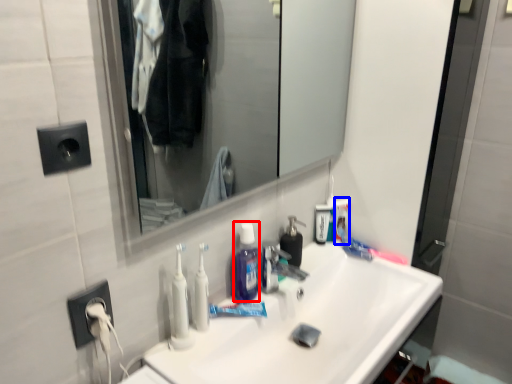
Question: Which object appears closest to the camera in this image, mouthwash (highlighted by a red box) or toiletry (highlighted by a blue box)?

Choices:
 (A) mouthwash
 (B) toiletry

Answer: (A)